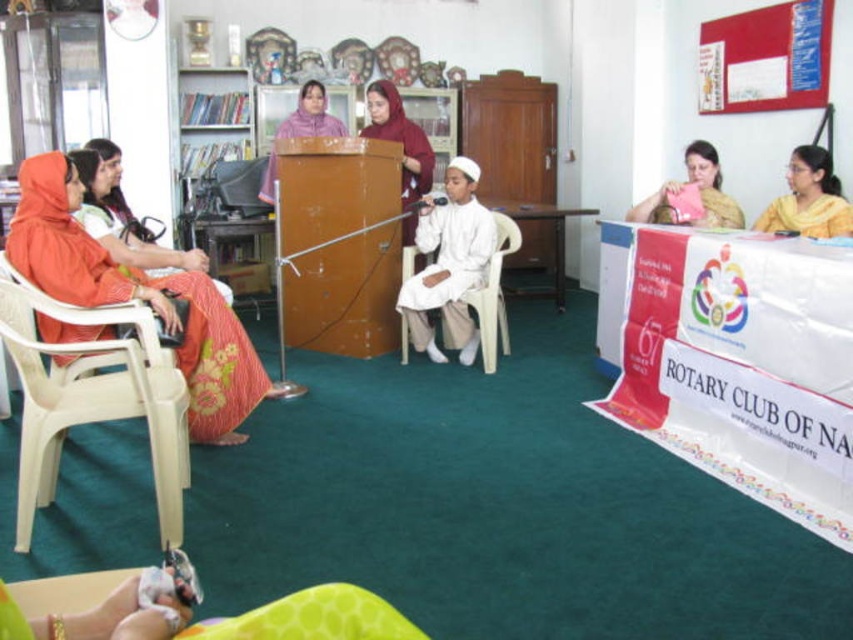
Is point (839, 230) less distant than point (366, 90)?

Yes.

Does yellow silk saree at upper right have a greater width compared to maroon fabric headscarf at center?

No.

Which is behind, point (788, 182) or point (392, 90)?

The point (392, 90) is more distant.

I want to click on yellow silk saree at upper right, so click(808, 198).

Can you confirm if orange fabric dress at left is smaller than pink fabric at center?

No, orange fabric dress at left is not smaller than pink fabric at center.

The image size is (853, 640). I want to click on orange fabric dress at left, so click(x=136, y=298).

Locate an element on the screen. orange fabric dress at left is located at coordinates (136, 298).

Locate an element on the screen. orange fabric dress at left is located at coordinates (136, 298).

Can you confirm if maroon fabric headscarf at center is taller than white plastic chair at center?

Yes.

Can you confirm if maroon fabric headscarf at center is positioned to the right of white plastic chair at center?

In fact, maroon fabric headscarf at center is to the left of white plastic chair at center.

Is point (370, 109) less distant than point (490, 355)?

No, (370, 109) is behind (490, 355).

I want to click on maroon fabric headscarf at center, so click(399, 138).